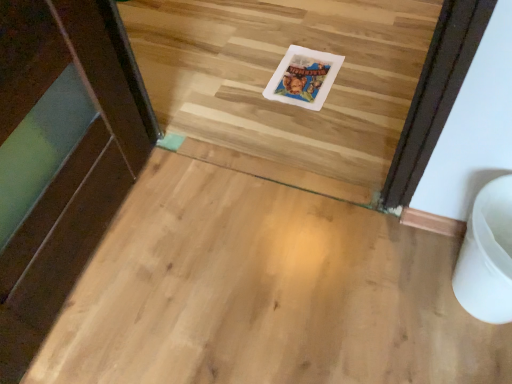
Question: Could you tell me if white plastic toilet bowl at lower right is turned towards white plastic postcard at center?

Choices:
 (A) no
 (B) yes

Answer: (A)

Question: Is white plastic toilet bowl at lower right beside white plastic postcard at center?

Choices:
 (A) no
 (B) yes

Answer: (A)

Question: Can you confirm if white plastic toilet bowl at lower right is positioned to the left of white plastic postcard at center?

Choices:
 (A) yes
 (B) no

Answer: (B)

Question: From a real-world perspective, is white plastic toilet bowl at lower right positioned over white plastic postcard at center based on gravity?

Choices:
 (A) no
 (B) yes

Answer: (B)

Question: From a real-world perspective, is white plastic toilet bowl at lower right positioned under white plastic postcard at center based on gravity?

Choices:
 (A) yes
 (B) no

Answer: (B)

Question: Does white plastic toilet bowl at lower right appear on the right side of white plastic postcard at center?

Choices:
 (A) yes
 (B) no

Answer: (A)

Question: Is white plastic postcard at center directly adjacent to white plastic toilet bowl at lower right?

Choices:
 (A) no
 (B) yes

Answer: (A)

Question: Is white plastic postcard at center surrounding white plastic toilet bowl at lower right?

Choices:
 (A) yes
 (B) no

Answer: (B)

Question: Is white plastic postcard at center facing away from white plastic toilet bowl at lower right?

Choices:
 (A) yes
 (B) no

Answer: (B)

Question: Does white plastic postcard at center lie in front of white plastic toilet bowl at lower right?

Choices:
 (A) no
 (B) yes

Answer: (A)

Question: Considering the relative sizes of white plastic postcard at center and white plastic toilet bowl at lower right in the image provided, is white plastic postcard at center taller than white plastic toilet bowl at lower right?

Choices:
 (A) no
 (B) yes

Answer: (A)

Question: From a real-world perspective, is white plastic postcard at center beneath white plastic toilet bowl at lower right?

Choices:
 (A) no
 (B) yes

Answer: (B)

Question: From the image's perspective, relative to white plastic toilet bowl at lower right, is white plastic postcard at center above or below?

Choices:
 (A) below
 (B) above

Answer: (B)